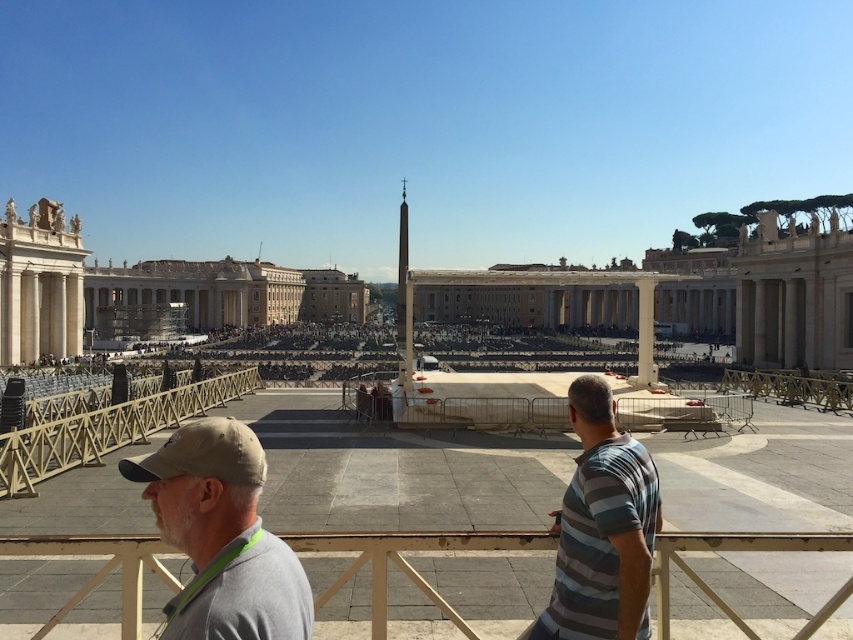
You are planning to place a small flowerpot between the beige metal rail at lower center and the white marble pillar at center. Based on their widths, which object should the flowerpot be placed closer to?

The beige metal rail at lower center might be wider than the white marble pillar at center, so the flowerpot should be placed closer to the white marble pillar at center to ensure there is enough space.

You are a tourist standing at the entrance of St. Peter Square and want to take a photo of the striped cotton shirt at center and the gray fabric cap at lower left. Can you fit both in your camera frame if the shirt is higher up than the cap?

The gray fabric cap at lower left is located below striped cotton shirt at center, so yes, the camera frame can include both the striped cotton shirt at center and the gray fabric cap at lower left since the shirt is above the cap.

You are a tourist standing at the lower center of St. Peter Square. You see the beige metal rail at lower center and the striped cotton shirt at center. Which object is shorter in height?

The beige metal rail at lower center is shorter in height compared to the striped cotton shirt at center.